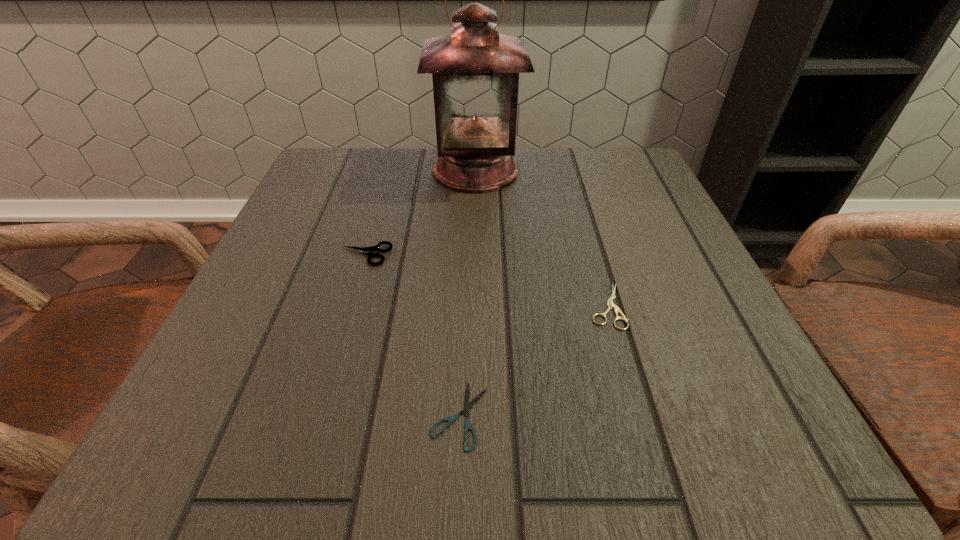
At what (x,y) coordinates should I click in order to perform the action: click on empty space that is in between the leftmost shears and the second nearest shears. Please return your answer as a coordinate pair (x, y). Looking at the image, I should click on (486, 280).

The height and width of the screenshot is (540, 960). I want to click on object identified as the closest to the second farthest object, so click(x=475, y=70).

Choose which object is the third nearest neighbor to the second nearest shears. Please provide its 2D coordinates. Your answer should be formatted as a tuple, i.e. [(x, y)], where the tuple contains the x and y coordinates of a point satisfying the conditions above.

[(368, 251)]

This screenshot has height=540, width=960. What are the coordinates of `the second closest shears to the second shortest object` in the screenshot? It's located at (368, 251).

Identify the location of shears that is the second nearest to the second shortest object. (368, 251).

Locate an element on the screen. vacant space that satisfies the following two spatial constraints: 1. on the front side of the tallest shears; 2. on the right side of the nearest object is located at coordinates (318, 415).

Locate an element on the screen. blank area in the image that satisfies the following two spatial constraints: 1. on the back side of the second tallest shears; 2. on the right side of the nearest object is located at coordinates click(x=464, y=306).

Find the location of a particular element. Image resolution: width=960 pixels, height=540 pixels. free space that satisfies the following two spatial constraints: 1. on the back side of the nearest object; 2. on the left side of the farthest object is located at coordinates (468, 170).